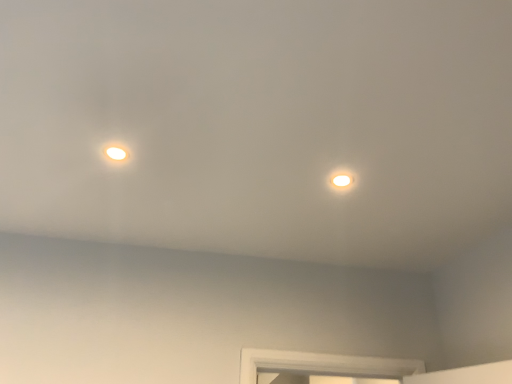
Identify the location of matte white droplight at upper left. (116, 153).

In the scene shown: What is the approximate width of matte white droplight at upper left?

The width of matte white droplight at upper left is 3.77 inches.

What do you see at coordinates (116, 153) in the screenshot? The width and height of the screenshot is (512, 384). I see `matte white droplight at upper left` at bounding box center [116, 153].

Locate an element on the screen. The image size is (512, 384). matte white light at upper right is located at coordinates click(x=342, y=180).

The height and width of the screenshot is (384, 512). What do you see at coordinates (342, 180) in the screenshot?
I see `matte white light at upper right` at bounding box center [342, 180].

The height and width of the screenshot is (384, 512). Find the location of `matte white droplight at upper left`. matte white droplight at upper left is located at coordinates (116, 153).

Consider the image. Considering the positions of objects matte white light at upper right and matte white droplight at upper left in the image provided, who is more to the left, matte white light at upper right or matte white droplight at upper left?

matte white droplight at upper left.

Is matte white light at upper right closer to camera compared to matte white droplight at upper left?

No, matte white light at upper right is behind matte white droplight at upper left.

Does point (347, 182) lie behind point (125, 147)?

Yes, point (347, 182) is behind point (125, 147).

Consider the image. From the image's perspective, which one is positioned higher, matte white light at upper right or matte white droplight at upper left?

matte white droplight at upper left.

From a real-world perspective, is matte white light at upper right over matte white droplight at upper left?

Yes, from a real-world perspective, matte white light at upper right is over matte white droplight at upper left

Looking at their sizes, would you say matte white light at upper right is wider or thinner than matte white droplight at upper left?

Clearly, matte white light at upper right has less width compared to matte white droplight at upper left.

Considering the sizes of objects matte white light at upper right and matte white droplight at upper left in the image provided, who is taller, matte white light at upper right or matte white droplight at upper left?

matte white droplight at upper left.

Looking at the image, does matte white light at upper right seem bigger or smaller compared to matte white droplight at upper left?

Clearly, matte white light at upper right is smaller in size than matte white droplight at upper left.

Would you say matte white light at upper right is outside matte white droplight at upper left?

Indeed, matte white light at upper right is completely outside matte white droplight at upper left.

Is matte white light at upper right positioned far away from matte white droplight at upper left?

Actually, matte white light at upper right and matte white droplight at upper left are a little close together.

Is matte white light at upper right facing away from matte white droplight at upper left?

No, matte white light at upper right is not facing the opposite direction of matte white droplight at upper left.

Measure the distance between matte white light at upper right and matte white droplight at upper left.

matte white light at upper right is 29.19 inches away from matte white droplight at upper left.

Locate an element on the screen. light below the matte white droplight at upper left (from the image's perspective) is located at coordinates (342, 180).

Is matte white droplight at upper left to the left or to the right of matte white light at upper right in the image?

From the image, it's evident that matte white droplight at upper left is to the left of matte white light at upper right.

Between matte white droplight at upper left and matte white light at upper right, which one is positioned in front?

Positioned in front is matte white droplight at upper left.

Considering the positions of point (119, 148) and point (338, 178), is point (119, 148) closer or farther from the camera than point (338, 178)?

Clearly, point (119, 148) is closer to the camera than point (338, 178).

From the image's perspective, is matte white droplight at upper left located above or below matte white light at upper right?

matte white droplight at upper left is situated higher than matte white light at upper right in the image.

From a real-world perspective, who is located higher, matte white droplight at upper left or matte white light at upper right?

matte white light at upper right, from a real-world perspective.

Looking at their sizes, would you say matte white droplight at upper left is wider or thinner than matte white light at upper right?

In the image, matte white droplight at upper left appears to be wider than matte white light at upper right.

Which of these two, matte white droplight at upper left or matte white light at upper right, stands taller?

matte white droplight at upper left is taller.

Is matte white droplight at upper left smaller than matte white light at upper right?

No, matte white droplight at upper left is not smaller than matte white light at upper right.

Is matte white droplight at upper left completely or partially outside of matte white light at upper right?

Yes, matte white droplight at upper left is not within matte white light at upper right.

Is matte white droplight at upper left far away from matte white light at upper right?

matte white droplight at upper left is actually quite close to matte white light at upper right.

Based on the photo, is matte white droplight at upper left positioned with its back to matte white light at upper right?

No, matte white light at upper right is not at the back of matte white droplight at upper left.

The height and width of the screenshot is (384, 512). In order to click on light behind the matte white droplight at upper left in this screenshot , I will do point(342,180).

This screenshot has height=384, width=512. What are the coordinates of `droplight that appears below the matte white light at upper right (from a real-world perspective)` in the screenshot? It's located at (116, 153).

Find the location of a particular element. Image resolution: width=512 pixels, height=384 pixels. light below the matte white droplight at upper left (from the image's perspective) is located at coordinates (342, 180).